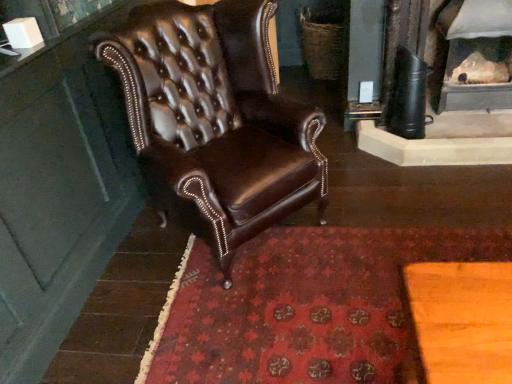
The width and height of the screenshot is (512, 384). Describe the element at coordinates (305, 307) in the screenshot. I see `red carpet at center` at that location.

This screenshot has height=384, width=512. Identify the location of red carpet at center. (305, 307).

Considering the positions of objects white textured fireplace at upper right and red carpet at center in the image provided, who is behind, white textured fireplace at upper right or red carpet at center?

Positioned behind is white textured fireplace at upper right.

Is white textured fireplace at upper right not close to red carpet at center?

That's right, there is a large distance between white textured fireplace at upper right and red carpet at center.

Considering the relative positions of white textured fireplace at upper right and red carpet at center in the image provided, is white textured fireplace at upper right to the right of red carpet at center from the viewer's perspective?

Yes, white textured fireplace at upper right is to the right of red carpet at center.

Is brown leather chair at center oriented towards red carpet at center?

Yes, brown leather chair at center is turned towards red carpet at center.

Can you confirm if brown leather chair at center is bigger than red carpet at center?

Yes, brown leather chair at center is bigger than red carpet at center.

Is point (264, 134) closer or farther from the camera than point (413, 257)?

Point (264, 134).

Looking at their sizes, would you say brown leather chair at center is wider or thinner than red carpet at center?

Considering their sizes, brown leather chair at center looks slimmer than red carpet at center.

What's the angular difference between brown leather chair at center and white textured fireplace at upper right's facing directions?

The angular difference between brown leather chair at center and white textured fireplace at upper right is 47.5 degrees.

Is point (139, 80) positioned after point (443, 82)?

No, it is not.

From the image's perspective, is brown leather chair at center above or below white textured fireplace at upper right?

Clearly, from the image's perspective, brown leather chair at center is below white textured fireplace at upper right.

Identify the location of fireplace behind the brown leather chair at center. The image size is (512, 384). (477, 55).

Consider the image. How different are the orientations of red carpet at center and white textured fireplace at upper right in degrees?

180 degrees separate the facing orientations of red carpet at center and white textured fireplace at upper right.

From the image's perspective, is red carpet at center on top of white textured fireplace at upper right?

No, from the image's perspective, red carpet at center is not above white textured fireplace at upper right.

In the scene shown: Is white textured fireplace at upper right completely or partially inside red carpet at center?

Definitely not — white textured fireplace at upper right is not inside red carpet at center.

Based on their positions, is red carpet at center located to the left or right of white textured fireplace at upper right?

red carpet at center is positioned on white textured fireplace at upper right's left side.

How distant is white textured fireplace at upper right from brown leather chair at center?

white textured fireplace at upper right is 5.38 feet from brown leather chair at center.

From the image's perspective, is white textured fireplace at upper right above or below brown leather chair at center?

white textured fireplace at upper right is above brown leather chair at center.

In terms of size, does white textured fireplace at upper right appear bigger or smaller than brown leather chair at center?

white textured fireplace at upper right is smaller than brown leather chair at center.

Does point (211, 330) come behind point (105, 62)?

Yes.

Is red carpet at center taller or shorter than brown leather chair at center?

Considering their sizes, red carpet at center has less height than brown leather chair at center.

Is red carpet at center facing away from brown leather chair at center?

No.

Where is `fireplace located above the red carpet at center (from the image's perspective)`? This screenshot has width=512, height=384. fireplace located above the red carpet at center (from the image's perspective) is located at coordinates (477, 55).

Identify the location of mat that is on the right side of brown leather chair at center. The width and height of the screenshot is (512, 384). (305, 307).

From the image, which object appears to be farther from red carpet at center, white textured fireplace at upper right or brown leather chair at center?

white textured fireplace at upper right lies further to red carpet at center than the other object.

Looking at the image, which one is located further to white textured fireplace at upper right, brown leather chair at center or red carpet at center?

brown leather chair at center is further to white textured fireplace at upper right.

Estimate the real-world distances between objects in this image. Which object is further from brown leather chair at center, white textured fireplace at upper right or red carpet at center?

→ white textured fireplace at upper right is positioned further to the anchor brown leather chair at center.

From the image, which object appears to be nearer to red carpet at center, brown leather chair at center or white textured fireplace at upper right?

The object closer to red carpet at center is brown leather chair at center.

Considering their positions, is red carpet at center positioned closer to brown leather chair at center than white textured fireplace at upper right?

Among the two, red carpet at center is located nearer to brown leather chair at center.

Considering their positions, is red carpet at center positioned closer to white textured fireplace at upper right than brown leather chair at center?

Based on the image, red carpet at center appears to be nearer to white textured fireplace at upper right.

Image resolution: width=512 pixels, height=384 pixels. Identify the location of mat located between brown leather chair at center and white textured fireplace at upper right in the left-right direction. (305, 307).